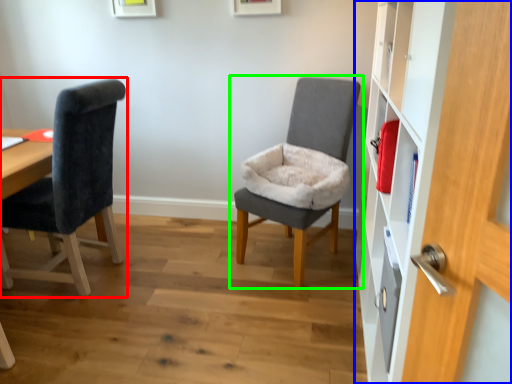
Question: Which object is the closest to the chair (highlighted by a red box)? Choose among these: dresser (highlighted by a blue box) or chair (highlighted by a green box).

Choices:
 (A) dresser
 (B) chair

Answer: (B)